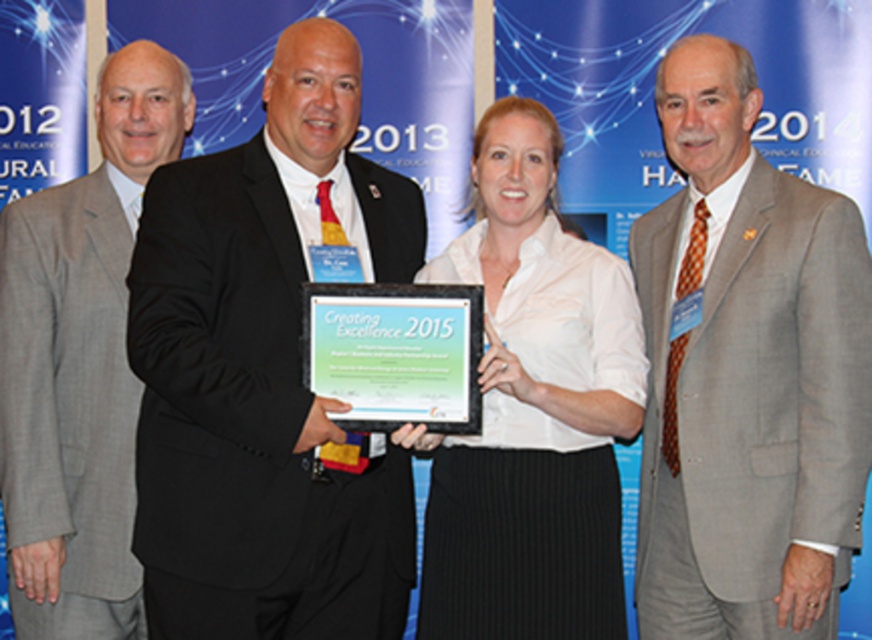
Is black suit at center closer to camera compared to gray suit at left?

Yes, it is in front of gray suit at left.

Locate an element on the screen. The height and width of the screenshot is (640, 872). black suit at center is located at coordinates (264, 376).

Does point (196, 260) come closer to viewer compared to point (49, 388)?

Yes, point (196, 260) is in front of point (49, 388).

Identify the location of black suit at center. (264, 376).

Between point (732, 332) and point (503, 156), which one is positioned in front?

Point (732, 332) is in front.

In order to click on gray wool suit at center in this screenshot , I will do `click(746, 372)`.

Can you confirm if white matte shirt at center is positioned to the right of green matte plaque at center?

Indeed, white matte shirt at center is positioned on the right side of green matte plaque at center.

Is white matte shirt at center above green matte plaque at center?

No, white matte shirt at center is not above green matte plaque at center.

Find the location of a particular element. This screenshot has height=640, width=872. white matte shirt at center is located at coordinates (533, 410).